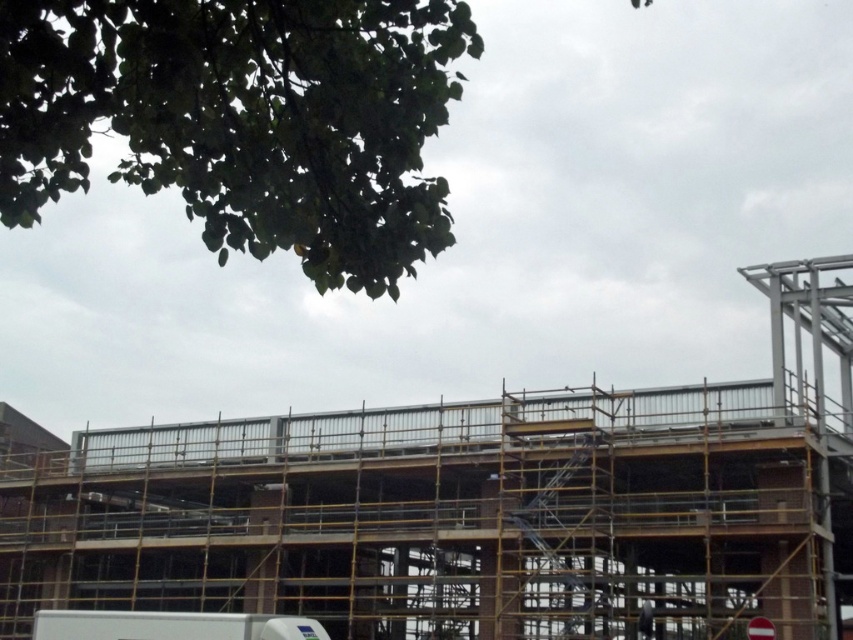
You are a delivery person needing to access the construction site. You see the metal scaffolding at center and the dark gray fabric construction worker at lower right. Which object is closer to the right side of the image?

The dark gray fabric construction worker at lower right is closer to the right side of the image because the metal scaffolding at center is to the left of it.

You are a construction supervisor checking the site. You see the metal scaffolding at center and the dark gray fabric construction worker at lower right. Which object is higher in the image?

The metal scaffolding at center is above the dark gray fabric construction worker at lower right, so the metal scaffolding at center is higher in the image.

You are a drone operator trying to capture a photo of the metal scaffolding at center and the dark gray fabric construction worker at lower right. From your current position, which object will appear larger in the photo?

The metal scaffolding at center will appear larger in the photo because it is closer to the viewer than the dark gray fabric construction worker at lower right.